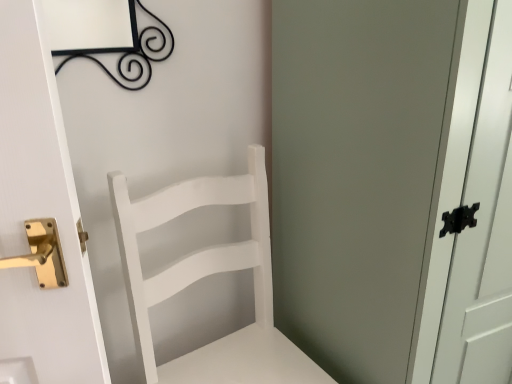
Question: Can you confirm if white matte chair at center is taller than white matte cabinet at right?

Choices:
 (A) no
 (B) yes

Answer: (A)

Question: Does white matte chair at center appear on the left side of white matte cabinet at right?

Choices:
 (A) yes
 (B) no

Answer: (A)

Question: Is white matte chair at center further to the viewer compared to white matte cabinet at right?

Choices:
 (A) yes
 (B) no

Answer: (A)

Question: Is white matte chair at center positioned before white matte cabinet at right?

Choices:
 (A) yes
 (B) no

Answer: (B)

Question: From a real-world perspective, is white matte chair at center under white matte cabinet at right?

Choices:
 (A) yes
 (B) no

Answer: (A)

Question: Is white matte chair at center looking in the opposite direction of white matte cabinet at right?

Choices:
 (A) no
 (B) yes

Answer: (A)

Question: Does white matte cabinet at right have a larger size compared to white matte chair at center?

Choices:
 (A) yes
 (B) no

Answer: (A)

Question: Considering the relative sizes of white matte cabinet at right and white matte chair at center in the image provided, is white matte cabinet at right shorter than white matte chair at center?

Choices:
 (A) no
 (B) yes

Answer: (A)

Question: From a real-world perspective, is white matte cabinet at right on white matte chair at center?

Choices:
 (A) no
 (B) yes

Answer: (B)

Question: Is white matte cabinet at right far away from white matte chair at center?

Choices:
 (A) no
 (B) yes

Answer: (A)

Question: Does white matte cabinet at right have a lesser width compared to white matte chair at center?

Choices:
 (A) no
 (B) yes

Answer: (A)

Question: Is white matte cabinet at right to the right of white matte chair at center from the viewer's perspective?

Choices:
 (A) yes
 (B) no

Answer: (A)

Question: From a real-world perspective, is white matte chair at center physically located above or below white matte cabinet at right?

Choices:
 (A) below
 (B) above

Answer: (A)